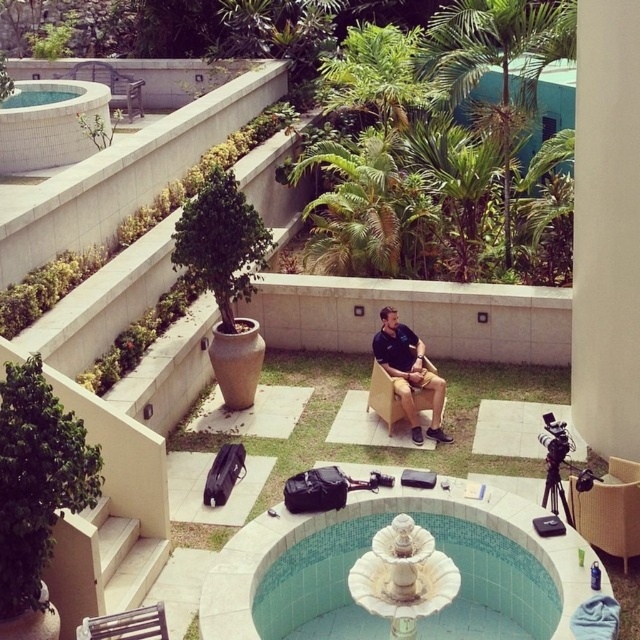
Who is more distant from viewer, [76,147] or [625,557]?

Point [76,147]

Between point (51, 161) and point (595, 520), which one is positioned in front?

Positioned in front is point (595, 520).

This screenshot has height=640, width=640. I want to click on white ceramic jacuzzi at upper left, so click(49, 124).

Locate an element on the screen. The image size is (640, 640). white ceramic fountain at center is located at coordinates (490, 584).

Is white ceramic fountain at center positioned at the back of rattan chair at center?

No, white ceramic fountain at center is closer to the viewer.

The image size is (640, 640). What do you see at coordinates (490, 584) in the screenshot?
I see `white ceramic fountain at center` at bounding box center [490, 584].

Find the location of a particular element. white ceramic fountain at center is located at coordinates (490, 584).

Is metallic silver chair at lower left to the left of wooden chair at center from the viewer's perspective?

Yes, metallic silver chair at lower left is to the left of wooden chair at center.

Between metallic silver chair at lower left and wooden chair at center, which one is positioned higher?

wooden chair at center is above.

Between point (90, 634) and point (385, 381), which one is positioned in front?

Point (90, 634) is more forward.

Locate an element on the screen. metallic silver chair at lower left is located at coordinates (125, 625).